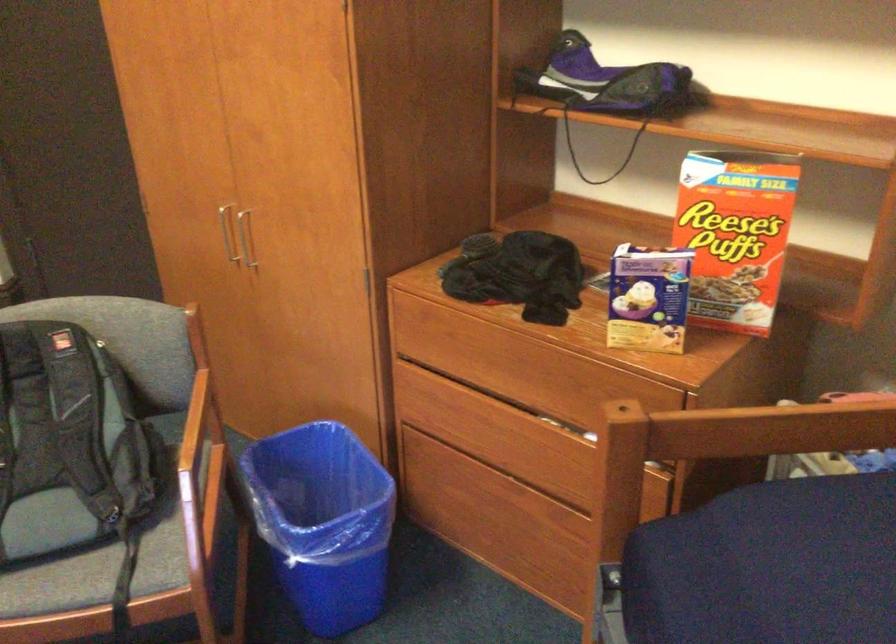
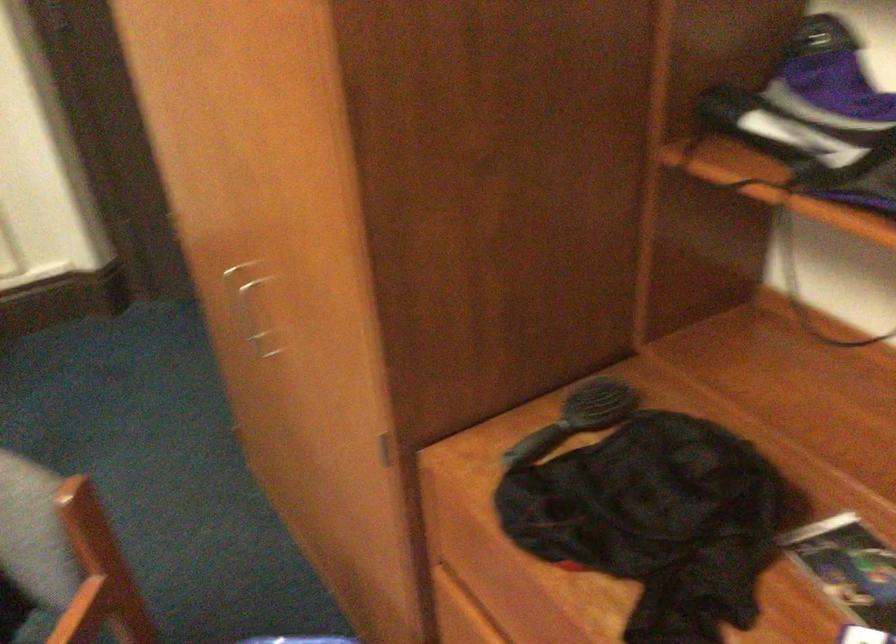
Question: In a continuous first-person perspective shot, in which direction is the camera moving?

Choices:
 (A) Left
 (B) Right
 (C) Forward
 (D) Backward

Answer: (C)